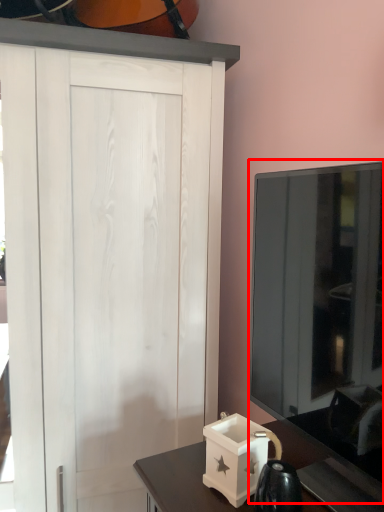
Question: From the image, what is the correct spatial relationship of glass door (annotated by the red box) in relation to box?

Choices:
 (A) left
 (B) right

Answer: (B)